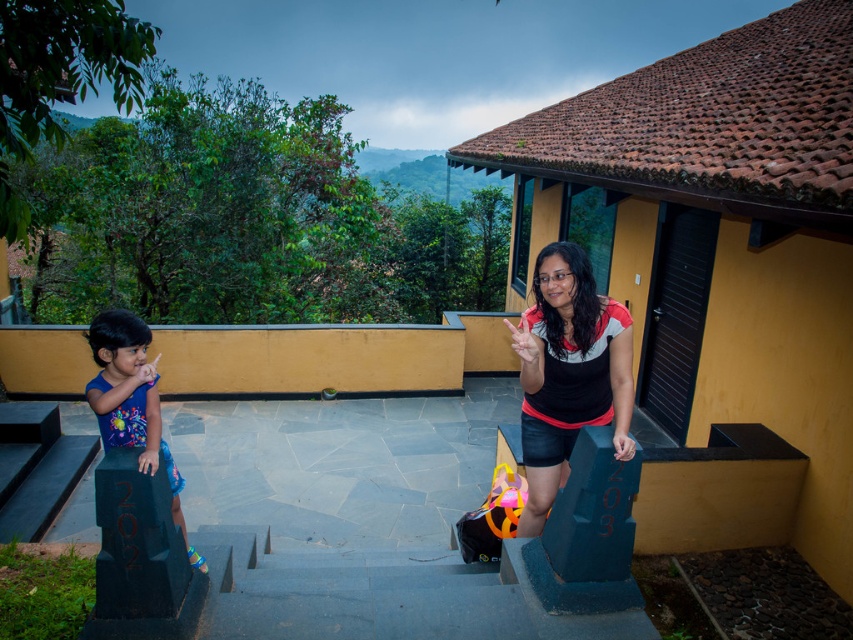
Can you confirm if matte black shirt at center is smaller than matte blue dress at left?

Incorrect, matte black shirt at center is not smaller in size than matte blue dress at left.

Can you confirm if matte black shirt at center is shorter than matte blue dress at left?

No, matte black shirt at center is not shorter than matte blue dress at left.

Locate an element on the screen. This screenshot has height=640, width=853. matte black shirt at center is located at coordinates (567, 372).

Is point (618, 417) behind point (115, 625)?

Yes, it is behind point (115, 625).

Is point (612, 419) closer to camera compared to point (125, 513)?

No, (612, 419) is behind (125, 513).

Identify the location of matte black shirt at center. (567, 372).

Image resolution: width=853 pixels, height=640 pixels. In order to click on matte black shirt at center in this screenshot , I will do 567,372.

Does black polished stone pillar at lower left have a larger size compared to matte blue dress at left?

Actually, black polished stone pillar at lower left might be smaller than matte blue dress at left.

The width and height of the screenshot is (853, 640). What do you see at coordinates (140, 557) in the screenshot?
I see `black polished stone pillar at lower left` at bounding box center [140, 557].

Which is behind, point (141, 582) or point (119, 333)?

The point (119, 333) is behind.

Image resolution: width=853 pixels, height=640 pixels. Identify the location of black polished stone pillar at lower left. (140, 557).